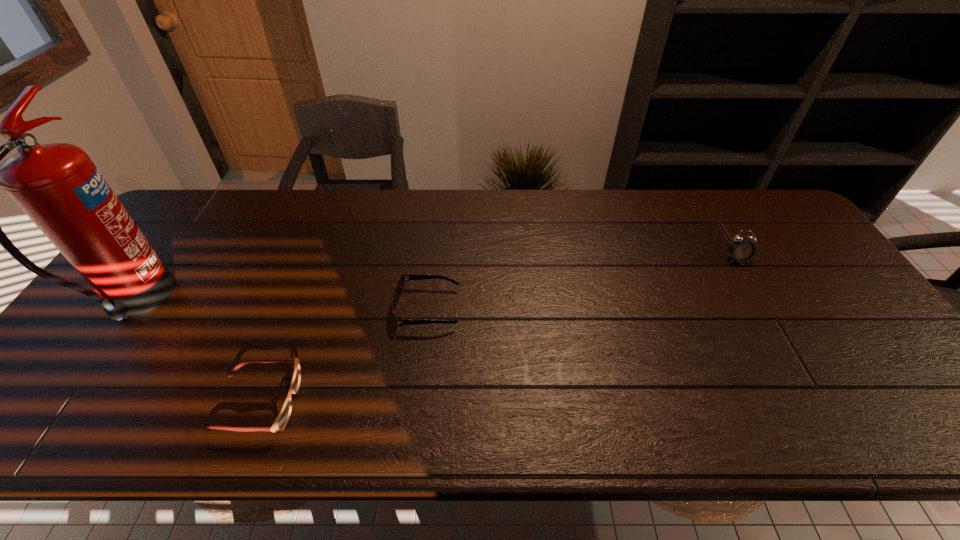
Where is `free location that satisfies the following two spatial constraints: 1. on the face of the alarm clock; 2. on the surface of the fire extinguisher`? This screenshot has width=960, height=540. free location that satisfies the following two spatial constraints: 1. on the face of the alarm clock; 2. on the surface of the fire extinguisher is located at coordinates (763, 304).

At what (x,y) coordinates should I click in order to perform the action: click on free space that satisfies the following two spatial constraints: 1. on the face of the third shortest object; 2. on the surface of the leftmost object. Please return your answer as a coordinate pair (x, y). Looking at the image, I should click on (763, 304).

Locate an element on the screen. Image resolution: width=960 pixels, height=540 pixels. free space that satisfies the following two spatial constraints: 1. on the face of the farthest object; 2. on the front-facing side of the sunglasses is located at coordinates (766, 309).

What are the coordinates of `vacant position in the image that satisfies the following two spatial constraints: 1. on the face of the rightmost object; 2. on the front-facing side of the second object from right to left` in the screenshot? It's located at (766, 309).